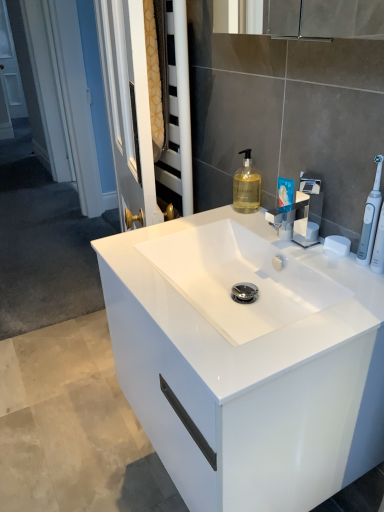
At what (x,y) coordinates should I click in order to perform the action: click on free space to the left of white plastic toothbrush at right. Please return your answer as a coordinate pair (x, y). Image resolution: width=384 pixels, height=512 pixels. Looking at the image, I should click on coord(314,260).